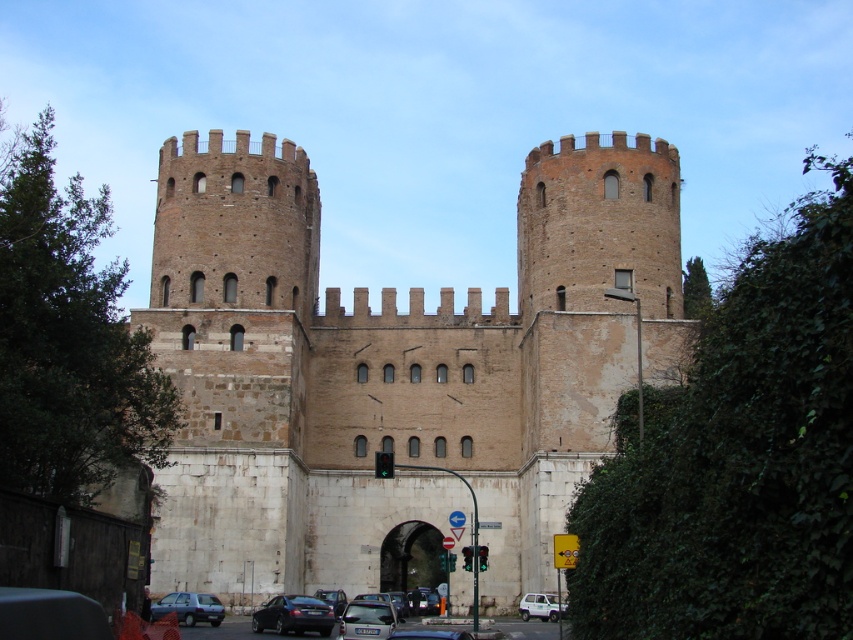
You are a delivery driver who needs to park your car between the metallic silver car at center and the matte gray car at lower left. The parking space between them is 12 feet long. Can your car, which is 10 feet long, fit into this space?

The distance between the metallic silver car at center and the matte gray car at lower left is 34.43 feet. Since the parking space is 12 feet long and your car is only 10 feet long, there is enough space to park your car between them.

You are standing at the intersection where the traffic light is green. You want to take a photo of the brown stone castle at center. Where should you position yourself to capture the castle in the center of your camera frame?

To capture the brown stone castle at center in the center of your camera frame, position yourself directly in front of the castle at point (393,369).

You are standing in front of the historic stone structure and want to walk towards the two points marked in the image. Which point, point (x=292, y=580) or point (x=300, y=632), will you reach first?

You will reach point (x=292, y=580) first because it is closer to you than point (x=300, y=632), which is further away.